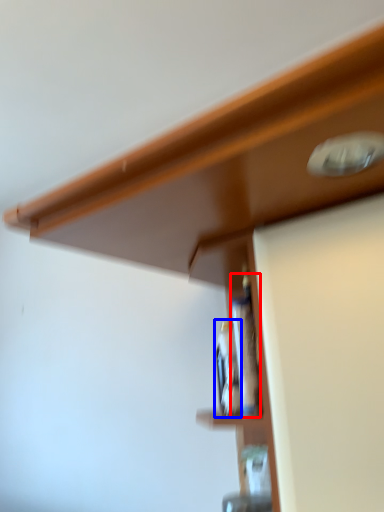
Question: Which point is closer to the camera, bottle (highlighted by a red box) or bottle (highlighted by a blue box)?

Choices:
 (A) bottle
 (B) bottle

Answer: (A)